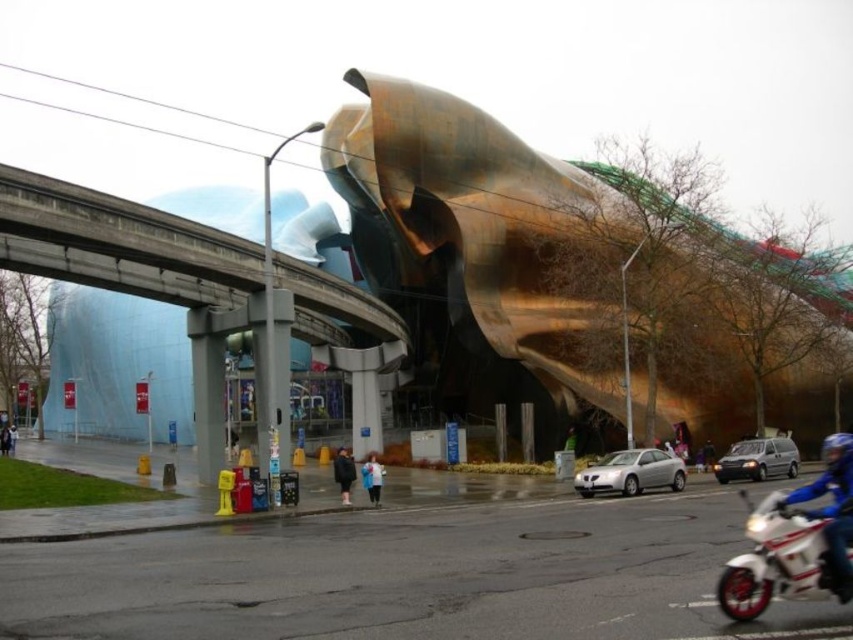
Who is lower down, silver metallic car at center or blue fabric jacket at center?

Positioned lower is silver metallic car at center.

Between silver metallic car at center and blue fabric jacket at center, which one appears on the left side from the viewer's perspective?

silver metallic car at center

At what (x,y) coordinates should I click in order to perform the action: click on silver metallic car at center. Please return your answer as a coordinate pair (x, y). Image resolution: width=853 pixels, height=640 pixels. Looking at the image, I should click on (631, 472).

This screenshot has height=640, width=853. I want to click on silver metallic car at center, so click(631, 472).

Is concrete bridge at center bigger than silver metallic car at center?

Yes, concrete bridge at center is bigger than silver metallic car at center.

Locate an element on the screen. concrete bridge at center is located at coordinates (117, 241).

Locate an element on the screen. concrete bridge at center is located at coordinates (117, 241).

In order to click on concrete bridge at center in this screenshot , I will do `click(117, 241)`.

Does white matte motorbike at lower right have a larger size compared to blue leather jacket at lower right?

Incorrect, white matte motorbike at lower right is not larger than blue leather jacket at lower right.

Who is higher up, white matte motorbike at lower right or blue leather jacket at lower right?

white matte motorbike at lower right is above.

Who is more forward, (805,512) or (833,544)?

Positioned in front is point (833,544).

Find the location of a particular element. white matte motorbike at lower right is located at coordinates (776, 560).